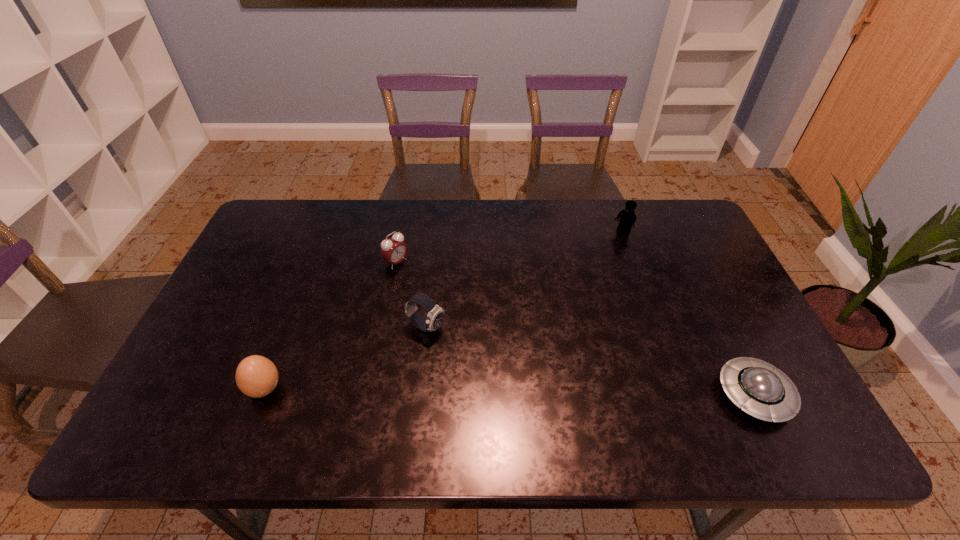
You are a GUI agent. You are given a task and a screenshot of the screen. Output one action in this format:
    pyautogui.click(x=<x>, y=<y>)
    Task: Click on the vacant space located on the back of the shortest object
    The image size is (960, 540).
    Given the screenshot: What is the action you would take?
    pyautogui.click(x=711, y=306)

You are a GUI agent. You are given a task and a screenshot of the screen. Output one action in this format:
    pyautogui.click(x=<x>, y=<y>)
    Task: Click on the vacant space located on the face of the watch
    
    Given the screenshot: What is the action you would take?
    pyautogui.click(x=465, y=347)

Image resolution: width=960 pixels, height=540 pixels. Identify the location of vacant area situated 0.160m on the face of the watch. (494, 363).

This screenshot has height=540, width=960. Find the location of `vacant space located on the face of the watch`. vacant space located on the face of the watch is located at coordinates (557, 397).

Find the location of `vacant space positioned on the front-facing side of the fourth object from left to right`. vacant space positioned on the front-facing side of the fourth object from left to right is located at coordinates (612, 244).

The height and width of the screenshot is (540, 960). In order to click on free space located 0.130m on the front-facing side of the fourth object from left to right in this screenshot , I will do `click(601, 258)`.

Where is `vacant space located on the front-facing side of the fourth object from left to right`? vacant space located on the front-facing side of the fourth object from left to right is located at coordinates (609, 247).

Find the location of a particular element. vacant space located on the clock face of the alarm clock is located at coordinates 492,330.

Identify the location of free region located 0.110m on the clock face of the alarm clock. (430, 286).

The height and width of the screenshot is (540, 960). In order to click on free spot located on the clock face of the alarm clock in this screenshot , I will do `click(440, 293)`.